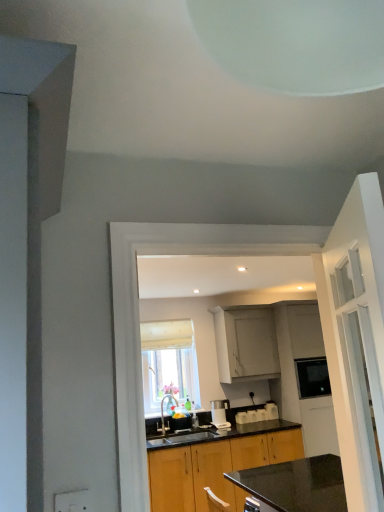
Question: From a real-world perspective, does satin silver coffee machine at center sit lower than white glass door at right?

Choices:
 (A) no
 (B) yes

Answer: (B)

Question: Is satin silver coffee machine at center wider than white glass door at right?

Choices:
 (A) yes
 (B) no

Answer: (A)

Question: From a real-world perspective, is satin silver coffee machine at center located higher than white glass door at right?

Choices:
 (A) no
 (B) yes

Answer: (A)

Question: Is satin silver coffee machine at center at the left side of white glass door at right?

Choices:
 (A) no
 (B) yes

Answer: (B)

Question: Does satin silver coffee machine at center have a lesser height compared to white glass door at right?

Choices:
 (A) yes
 (B) no

Answer: (A)

Question: Is satin silver coffee machine at center thinner than white glass door at right?

Choices:
 (A) yes
 (B) no

Answer: (B)

Question: From a real-world perspective, is wooden cabinet at center, the second cabinetry from the top, positioned over white fabric window at center based on gravity?

Choices:
 (A) no
 (B) yes

Answer: (A)

Question: Can you see wooden cabinet at center, the second cabinetry from the top, touching white fabric window at center?

Choices:
 (A) yes
 (B) no

Answer: (B)

Question: Is wooden cabinet at center, the second cabinetry from the top, behind white fabric window at center?

Choices:
 (A) no
 (B) yes

Answer: (A)

Question: Does wooden cabinet at center, the 1th cabinetry when ordered from bottom to top, appear on the left side of white fabric window at center?

Choices:
 (A) no
 (B) yes

Answer: (A)

Question: Considering the relative sizes of wooden cabinet at center, the 1th cabinetry when ordered from bottom to top, and white fabric window at center in the image provided, is wooden cabinet at center, the 1th cabinetry when ordered from bottom to top, wider than white fabric window at center?

Choices:
 (A) yes
 (B) no

Answer: (A)

Question: From the image's perspective, is wooden cabinet at center, the 1th cabinetry when ordered from bottom to top, below white fabric window at center?

Choices:
 (A) yes
 (B) no

Answer: (A)

Question: Is white matte cabinet at upper center, marked as the 2th cabinetry in a bottom-to-top arrangement, at the right side of brushed metal faucet at center?

Choices:
 (A) no
 (B) yes

Answer: (B)